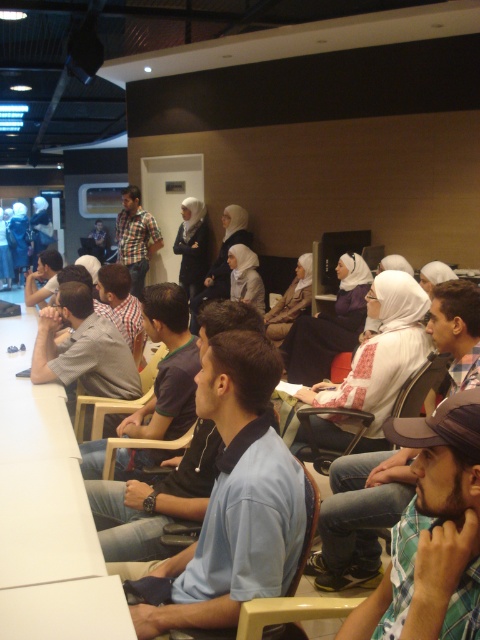
Is wooden chair at center further to the viewer compared to light brown plastic chair at center?

Yes, wooden chair at center is behind light brown plastic chair at center.

Which is above, wooden chair at center or light brown plastic chair at center?

wooden chair at center is higher up.

What are the coordinates of `wooden chair at center` in the screenshot? It's located at (115, 401).

How distant is plastic chair at center from wooden chair at center?

plastic chair at center and wooden chair at center are 38.39 inches apart from each other.

Is point (342, 413) less distant than point (96, 400)?

Yes, point (342, 413) is closer to viewer.

Image resolution: width=480 pixels, height=640 pixels. Identify the location of plastic chair at center. (326, 449).

Is plaid shirt at center further to the viewer compared to wooden chair at center?

Yes, it is.

Looking at this image, does plaid shirt at center lie in front of wooden chair at center?

No, it is behind wooden chair at center.

Who is more distant from viewer, (133, 268) or (80, 422)?

The point (133, 268) is more distant.

This screenshot has height=640, width=480. In order to click on plaid shirt at center in this screenshot , I will do `click(135, 237)`.